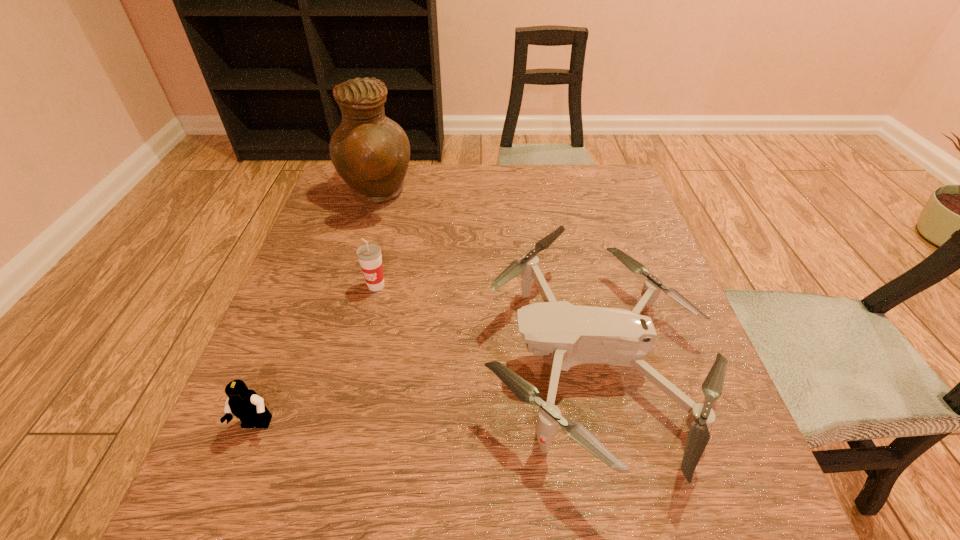
Where is `free spot between the Lego and the cup`? This screenshot has height=540, width=960. free spot between the Lego and the cup is located at coordinates (316, 355).

Where is `free space between the drone and the Lego`? free space between the drone and the Lego is located at coordinates (425, 392).

You are a GUI agent. You are given a task and a screenshot of the screen. Output one action in this format:
    pyautogui.click(x=<x>, y=<y>)
    Task: Click on the blank region between the rightmost object and the Lego
    Image resolution: width=960 pixels, height=540 pixels.
    Given the screenshot: What is the action you would take?
    pyautogui.click(x=425, y=392)

Locate an element on the screen. This screenshot has width=960, height=540. unoccupied area between the pitcher and the cup is located at coordinates (376, 240).

Where is `the closest object to the Lego`? The height and width of the screenshot is (540, 960). the closest object to the Lego is located at coordinates (369, 255).

Find the location of a particular element. object that is the closest one to the cup is located at coordinates (371, 153).

Locate an element on the screen. This screenshot has height=540, width=960. vacant point that satisfies the following two spatial constraints: 1. at the spout of the pitcher; 2. on the front-facing side of the Lego is located at coordinates (307, 425).

This screenshot has width=960, height=540. I want to click on free space that satisfies the following two spatial constraints: 1. at the spout of the tallest object; 2. on the front-facing side of the Lego, so click(x=307, y=425).

Find the location of a particular element. This screenshot has height=540, width=960. vacant point that satisfies the following two spatial constraints: 1. with a camera at the front of the rightmost object; 2. on the front-facing side of the Lego is located at coordinates (609, 425).

Locate an element on the screen. This screenshot has height=540, width=960. free space in the image that satisfies the following two spatial constraints: 1. at the spout of the tallest object; 2. on the front-facing side of the Lego is located at coordinates (307, 425).